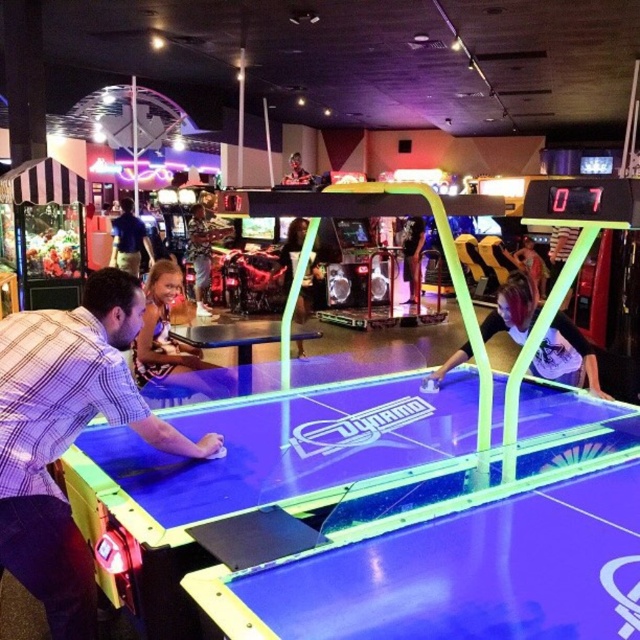
You are a customer in the arcade and want to join the game. There are two players already at the air hockey table. One is wearing a matte purple shirt at center and the other a camouflage shirt at center. Which direction should you stand to face the same direction as the existing players?

The matte purple shirt at center is to the right of the camouflage shirt at center, so the players are facing each other across the table. To join, you should stand on the side opposite to one of the existing players, either to the left of the camouflage shirt at center or the right of the matte purple shirt at center, ensuring you face the opposing player.

Based on the photo, you are standing at the entrance of the arcade and see the neon air hockey table with the matte purple shirt at center and the black leather jacket at center. Which one is positioned to the left side of the other?

The matte purple shirt at center is to the left of the black leather jacket at center.